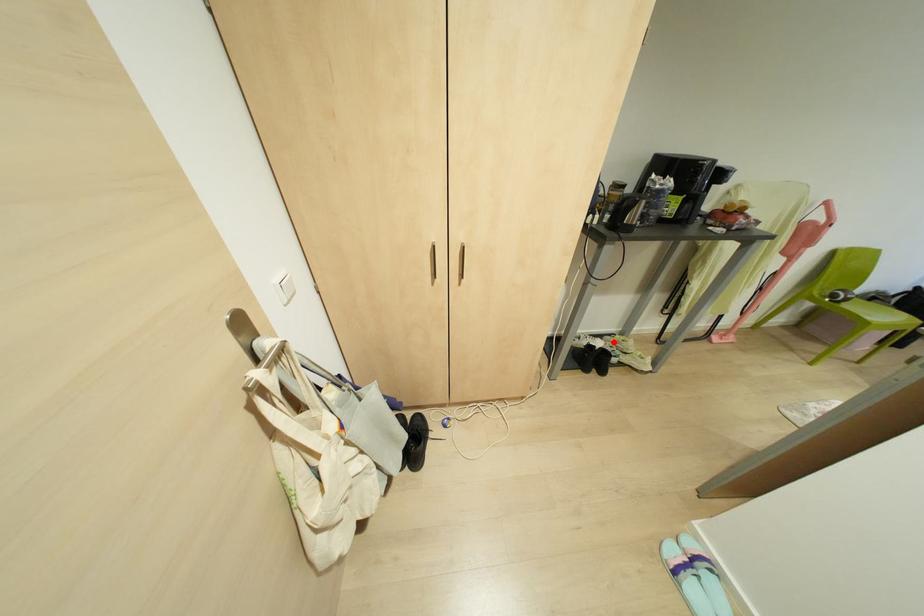
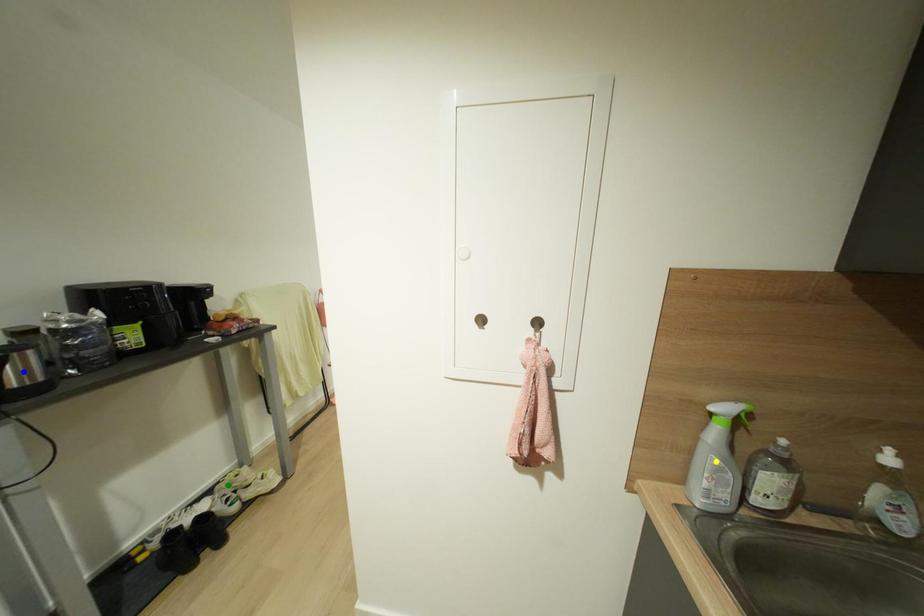
Question: I am providing you with two images of the same scene from different viewpoints. A red point is marked on the first image. You are given multiple points on the second image. Which point in image 2 represents the same 3d spot as the red point in image 1?

Choices:
 (A) blue point
 (B) yellow point
 (C) green point

Answer: (C)